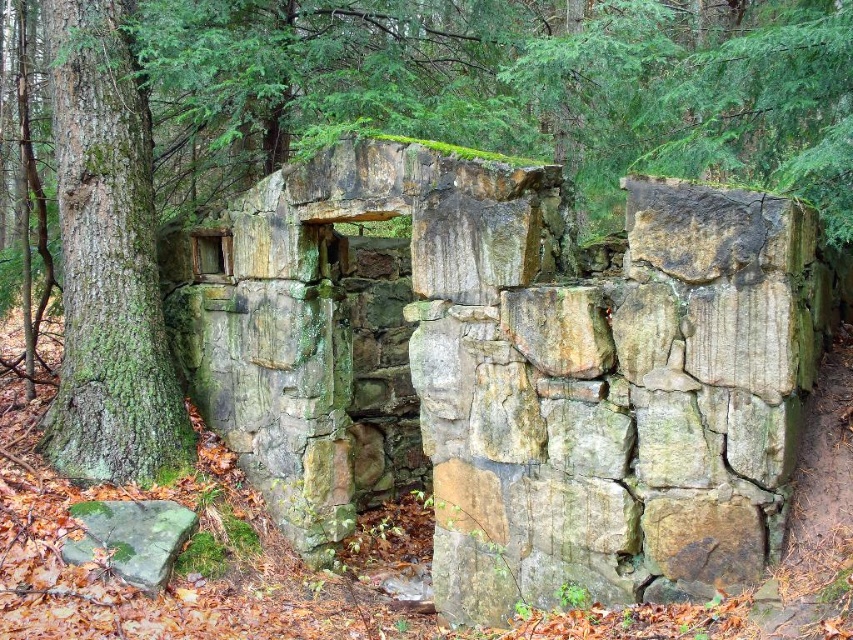
You are an archaeologist examining the old stone structure. You need to determine which object between the green mossy stone wall at center and the green mossy rock at lower left has a greater width. Which one is wider?

The green mossy stone wall at center is wider than the green mossy rock at lower left.